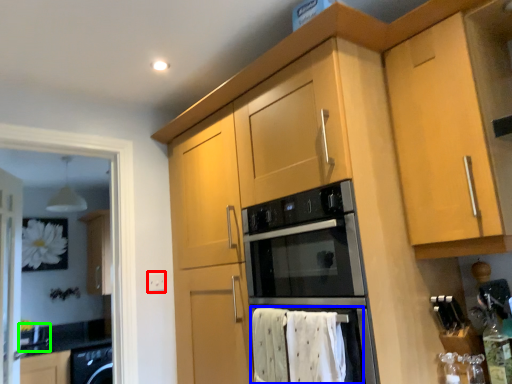
Question: Considering the real-world distances, which object is farthest from electric outlet (highlighted by a red box)? bath towel (highlighted by a blue box) or sink (highlighted by a green box)?

Choices:
 (A) bath towel
 (B) sink

Answer: (B)